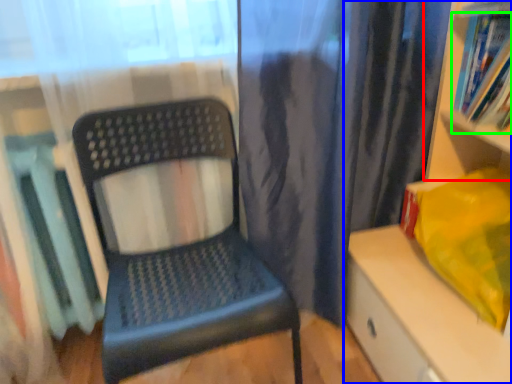
Question: Which object is the farthest from shelf (highlighted by a red box)? Choose among these: shelf (highlighted by a blue box) or book (highlighted by a green box).

Choices:
 (A) shelf
 (B) book

Answer: (A)